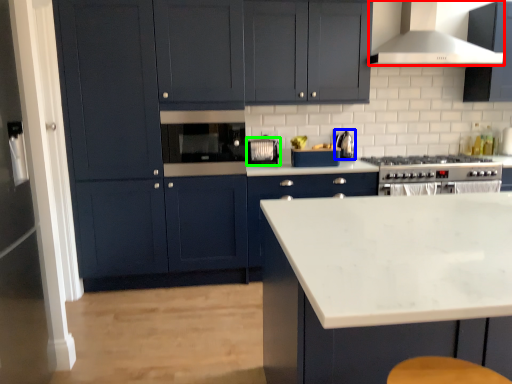
Question: Based on their relative distances, which object is farther from home appliance (highlighted by a red box)? Choose from kitchen appliance (highlighted by a blue box) and appliance (highlighted by a green box).

Choices:
 (A) kitchen appliance
 (B) appliance

Answer: (B)